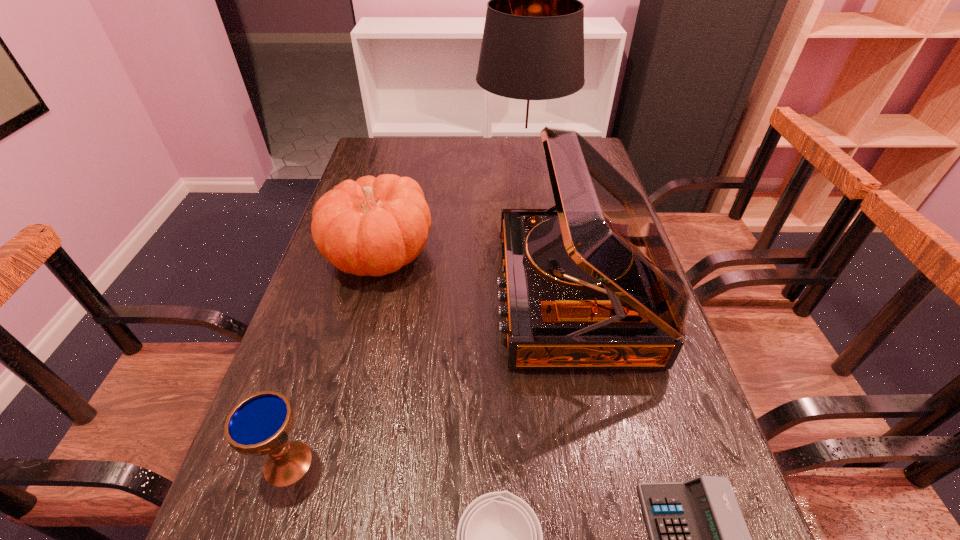
Locate an element on the screen. free region at the far left corner is located at coordinates (392, 146).

Identify the location of free spot between the farthest object and the chalice. (406, 313).

You are a GUI agent. You are given a task and a screenshot of the screen. Output one action in this format:
    pyautogui.click(x=<x>, y=<y>)
    Task: Click on the free point between the third shortest object and the lampshade
    This screenshot has width=960, height=540.
    Given the screenshot: What is the action you would take?
    pyautogui.click(x=406, y=313)

I want to click on vacant area that lies between the pumpkin and the tallest object, so point(451,209).

Where is `empty space that is in between the lampshade and the third shortest object`? Image resolution: width=960 pixels, height=540 pixels. empty space that is in between the lampshade and the third shortest object is located at coordinates (406, 313).

Where is `empty space between the tallest object and the third shortest object`? This screenshot has height=540, width=960. empty space between the tallest object and the third shortest object is located at coordinates (406, 313).

Find the location of a particular element. Image resolution: width=960 pixels, height=540 pixels. object that is the fourth closest to the farthest object is located at coordinates (699, 539).

You are a GUI agent. You are given a task and a screenshot of the screen. Output one action in this format:
    pyautogui.click(x=<x>, y=<y>)
    Task: Click on the object identified as the second closest to the soup bowl
    This screenshot has width=960, height=540.
    Given the screenshot: What is the action you would take?
    pyautogui.click(x=589, y=283)